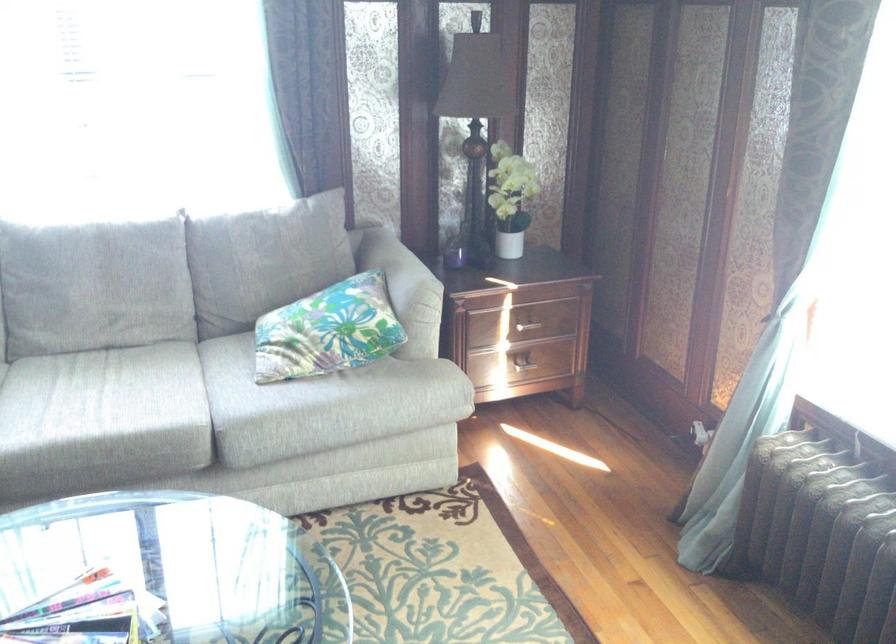
At what (x,y) coordinates should I click in order to perform the action: click on floral patterned pillow. Please return your answer as a coordinate pair (x, y). The width and height of the screenshot is (896, 644). Looking at the image, I should click on pyautogui.click(x=328, y=330).